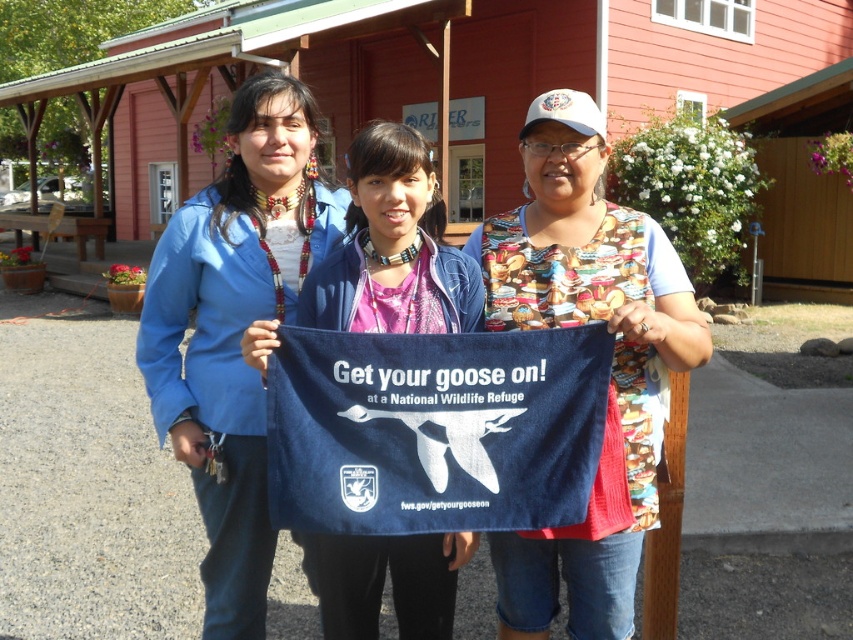
Does printed fabric apron at center have a larger size compared to blue fabric bag at center?

Correct, printed fabric apron at center is larger in size than blue fabric bag at center.

Who is shorter, printed fabric apron at center or blue fabric bag at center?

printed fabric apron at center

Identify the location of printed fabric apron at center. (612, 360).

Is point (329, 262) less distant than point (263, 122)?

Yes, it is.

Can you confirm if navy blue towel at center is positioned above blue fabric bag at center?

Indeed, navy blue towel at center is positioned over blue fabric bag at center.

Does point (358, 266) come in front of point (236, 196)?

Yes, it is in front of point (236, 196).

The height and width of the screenshot is (640, 853). Identify the location of navy blue towel at center. (527, 308).

Is navy blue towel at center to the right of printed fabric apron at center from the viewer's perspective?

In fact, navy blue towel at center is to the left of printed fabric apron at center.

Is navy blue towel at center positioned at the back of printed fabric apron at center?

No, navy blue towel at center is in front of printed fabric apron at center.

Identify the location of navy blue towel at center. The width and height of the screenshot is (853, 640). (527, 308).